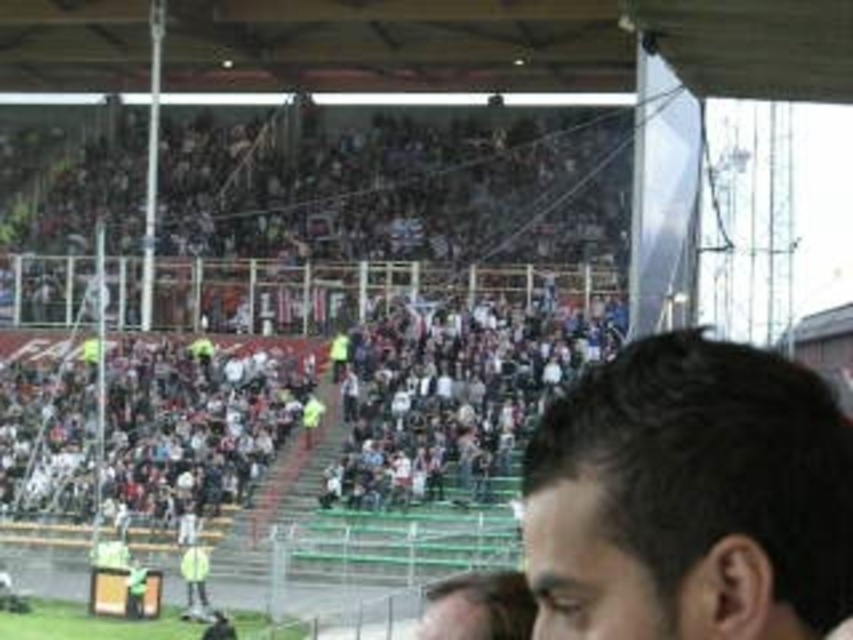
You are a photographer at the stadium and need to capture a photo that includes both the multicolored fabric crowd at upper center and the dark brown hair at lower right. Based on their positions, which object is located higher in the image?

The multicolored fabric crowd at upper center is located higher in the image than the dark brown hair at lower right.

Looking at this image, you are at the stadium and want to find a spot to watch the game. You see a point marked at coordinates (360, 304). What is the most likely object or feature located at that point?

The point at coordinates (360, 304) indicates the multicolored fabric crowd at upper center.